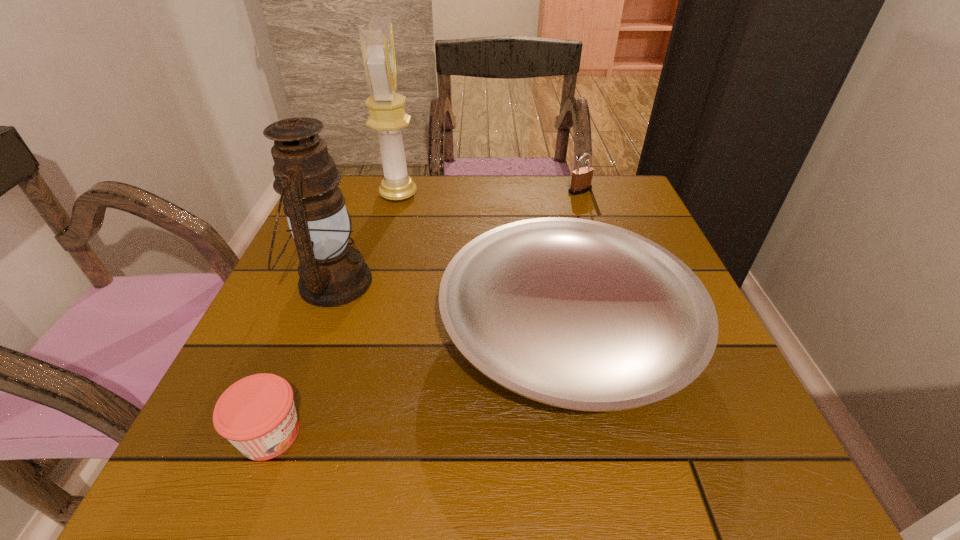
The height and width of the screenshot is (540, 960). I want to click on the tallest object, so click(387, 113).

Locate an element on the screen. The width and height of the screenshot is (960, 540). oil lamp is located at coordinates (331, 273).

This screenshot has height=540, width=960. In order to click on padlock in this screenshot , I will do `click(581, 180)`.

Find the location of a particular element. The height and width of the screenshot is (540, 960). bedpan is located at coordinates (578, 314).

The image size is (960, 540). Identify the location of jam. (257, 414).

Find the location of `free space located 0.060m on the front-facing side of the tallest object`. free space located 0.060m on the front-facing side of the tallest object is located at coordinates (441, 195).

This screenshot has width=960, height=540. Identify the location of vacant point located on the front of the fourth shortest object. (260, 472).

Find the location of a particular element. vacant space situated 0.150m on the front of the third shortest object is located at coordinates (592, 228).

Where is `free spot located 0.200m on the back of the bedpan`? The image size is (960, 540). free spot located 0.200m on the back of the bedpan is located at coordinates (542, 204).

In order to click on free region located on the front label of the jam in this screenshot , I will do `click(490, 434)`.